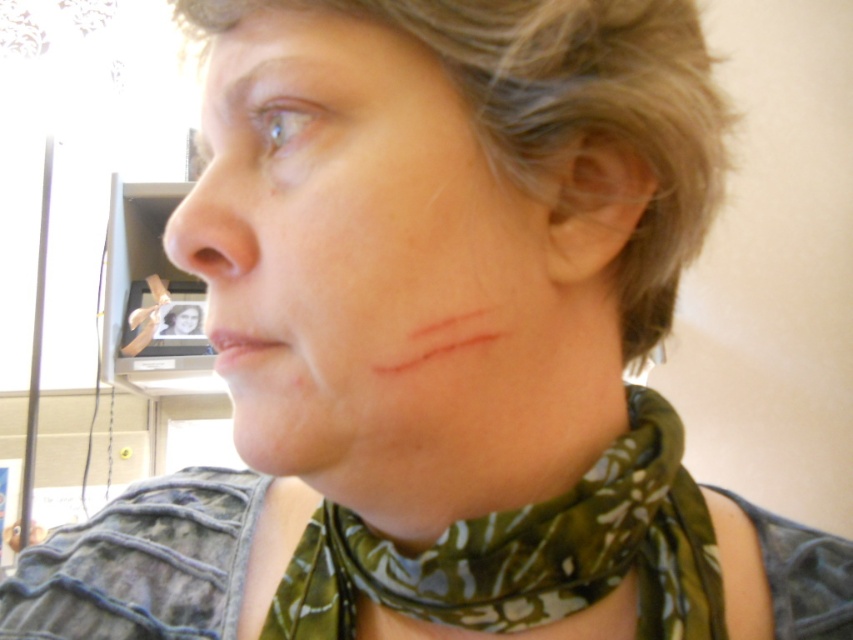
Question: Which object is the closest to the skin at center?

Choices:
 (A) green printed fabric scarf at lower center
 (B) light brown textured hair at upper right

Answer: (A)

Question: Can you confirm if light brown textured hair at upper right is bigger than matte skin nose at center?

Choices:
 (A) yes
 (B) no

Answer: (A)

Question: Observing the image, what is the correct spatial positioning of green printed fabric scarf at lower center in reference to matte skin nose at center?

Choices:
 (A) right
 (B) left

Answer: (A)

Question: Among these objects, which one is farthest from the camera?

Choices:
 (A) matte skin nose at center
 (B) light brown textured hair at upper right
 (C) green printed fabric scarf at lower center
 (D) skin at center

Answer: (C)

Question: Among these objects, which one is nearest to the camera?

Choices:
 (A) matte skin nose at center
 (B) skin at center
 (C) green printed fabric scarf at lower center

Answer: (B)

Question: Is the position of skin at center more distant than that of green printed fabric scarf at lower center?

Choices:
 (A) no
 (B) yes

Answer: (A)